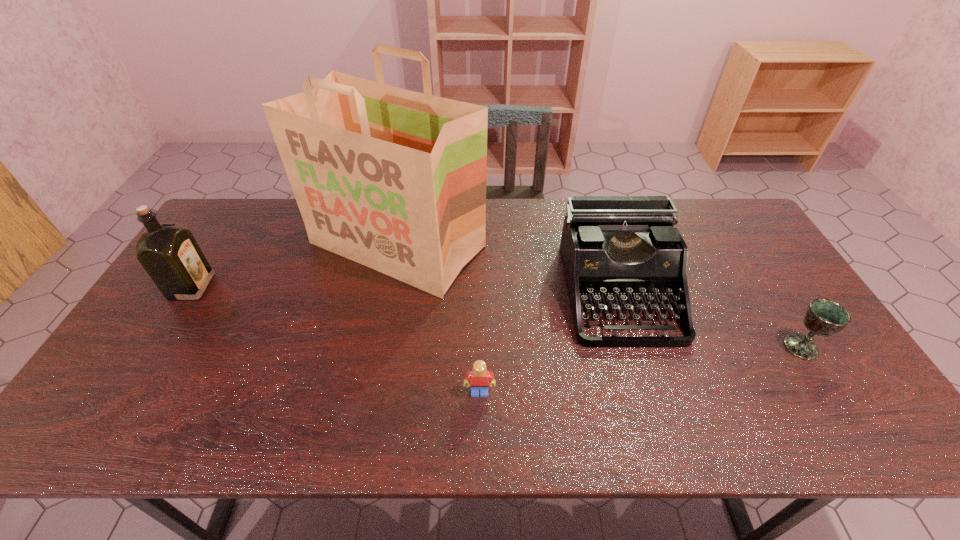
Find the location of `free space between the fourth object from left to right and the nearest object`. free space between the fourth object from left to right and the nearest object is located at coordinates (549, 342).

Image resolution: width=960 pixels, height=540 pixels. Identify the location of free space between the grocery bag and the liquor. (295, 266).

Identify the location of vacant point located between the liquor and the third tallest object. The width and height of the screenshot is (960, 540). (405, 289).

Find the location of a particular element. object identified as the closest to the second object from right to left is located at coordinates [393, 179].

Identify the location of object that is the closest to the rightmost object. The height and width of the screenshot is (540, 960). (614, 249).

The image size is (960, 540). I want to click on vacant space that satisfies the following two spatial constraints: 1. on the label of the chalice; 2. on the left side of the liquor, so click(154, 347).

This screenshot has width=960, height=540. What are the coordinates of `vacant space that satisfies the following two spatial constraints: 1. on the label of the rightmost object; 2. on the left side of the liquor` in the screenshot? It's located at (154, 347).